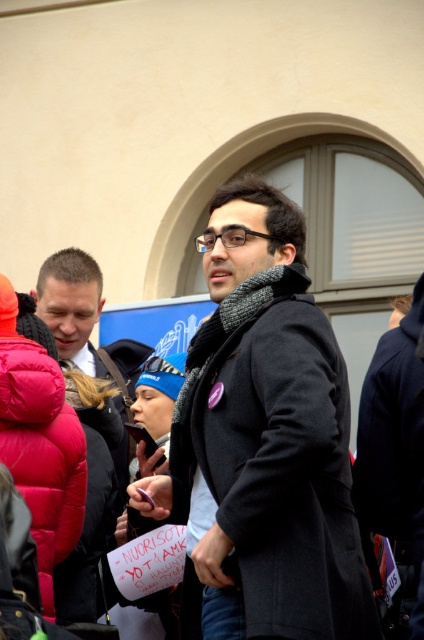
Question: Does black woolen coat at center appear under knitted wool scarf at center?

Choices:
 (A) no
 (B) yes

Answer: (B)

Question: Which of the following is the closest to the observer?

Choices:
 (A) (357, 627)
 (B) (161, 406)
 (C) (197, 348)

Answer: (A)

Question: Does black woolen coat at center appear on the left side of blue knit cap at center?

Choices:
 (A) no
 (B) yes

Answer: (A)

Question: Which point is closer to the camera?

Choices:
 (A) (348, 621)
 (B) (113, 620)
 (C) (64, 433)
 (D) (192, 390)

Answer: (A)

Question: Which point appears closest to the camera in this image?

Choices:
 (A) [142, 394]
 (B) [83, 512]
 (C) [343, 596]

Answer: (C)

Question: Is black woolen coat at center below blue knit cap at center?

Choices:
 (A) yes
 (B) no

Answer: (B)